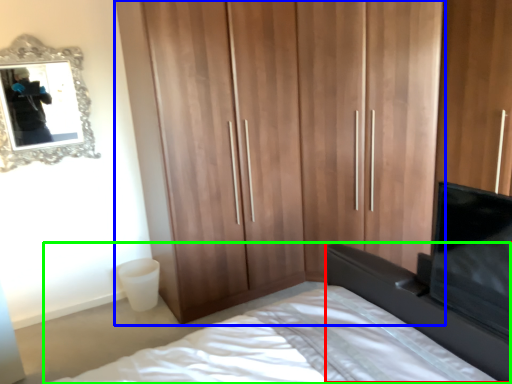
Question: Estimate the real-world distances between objects in this image. Which object is closer to vanity (highlighted by a red box), cupboard (highlighted by a blue box) or bed (highlighted by a green box)?

Choices:
 (A) cupboard
 (B) bed

Answer: (B)